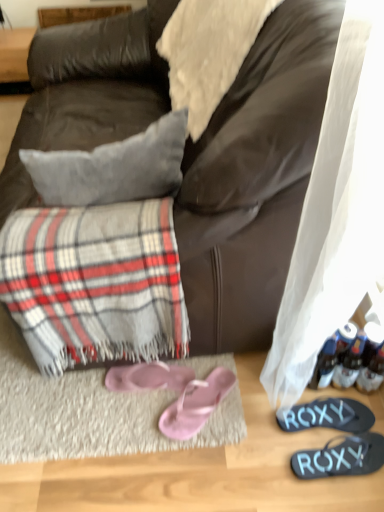
Question: Considering the positions of white fuzzy blanket at upper center and black rubber flip-flops at lower right, which is the fourth footwear in left-to-right order, in the image, is white fuzzy blanket at upper center wider or thinner than black rubber flip-flops at lower right, which is the fourth footwear in left-to-right order,?

Choices:
 (A) wide
 (B) thin

Answer: (A)

Question: Considering the positions of white fuzzy blanket at upper center and black rubber flip-flops at lower right, which is the fourth footwear in left-to-right order, in the image, is white fuzzy blanket at upper center bigger or smaller than black rubber flip-flops at lower right, which is the fourth footwear in left-to-right order,?

Choices:
 (A) small
 (B) big

Answer: (B)

Question: Which of these objects is positioned farthest from the plaid fabric at lower left?

Choices:
 (A) pink fabric flip-flops at lower center, which is counted as the 4th footwear, starting from the right
 (B) black rubber flip-flops at lower right, marked as the second footwear in a right-to-left arrangement
 (C) black rubber flip-flops at lower right, which is the first footwear from right to left
 (D) pink satin flip-flops at lower center, which is the 3th footwear in right-to-left order
 (E) white fuzzy blanket at upper center

Answer: (C)

Question: Estimate the real-world distances between objects in this image. Which object is farther from the white fuzzy blanket at upper center?

Choices:
 (A) black rubber flip-flops at lower right, the third footwear in the left-to-right sequence
 (B) plaid fabric at lower left
 (C) dark brown leather couch at center
 (D) black rubber flip-flops at lower right, which is the fourth footwear in left-to-right order
 (E) pink fabric flip-flops at lower center, which is counted as the 4th footwear, starting from the right

Answer: (D)